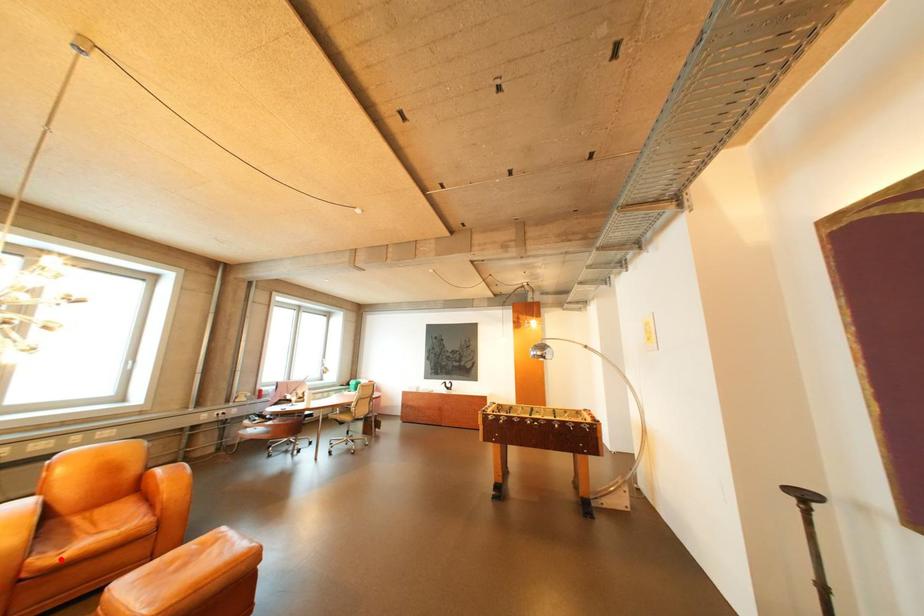
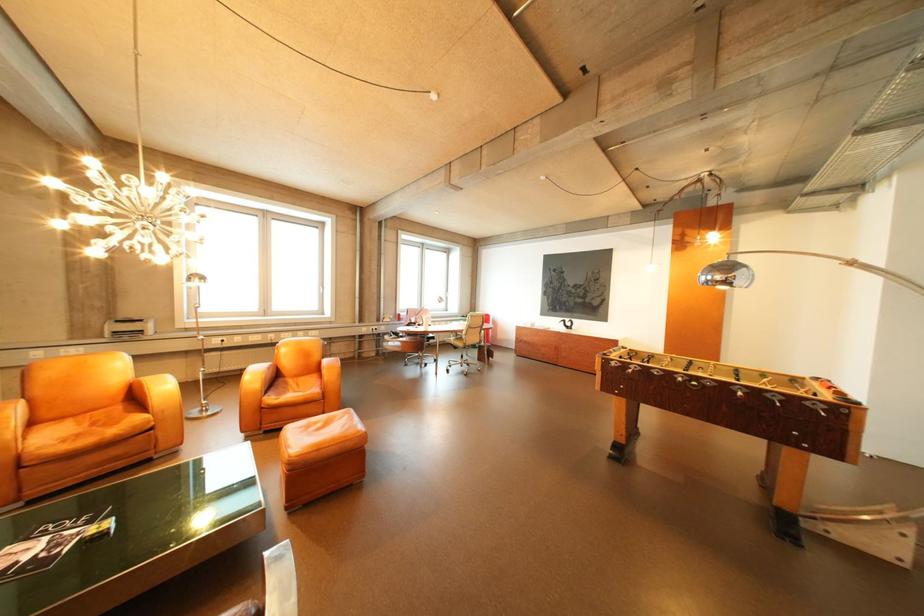
The point at the highlighted location is marked in the first image. Where is the corresponding point in the second image?

(285, 400)